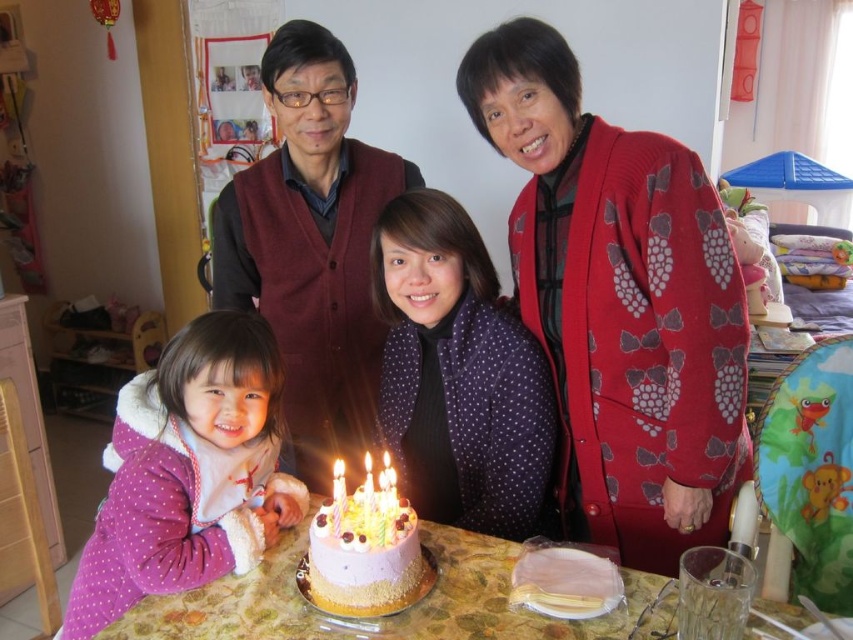
Question: Which is nearer to the marble-patterned table at center?

Choices:
 (A) red knitwear at upper right
 (B) purple dotted sweater at center
 (C) purple fleece jacket at lower left

Answer: (C)

Question: Which object appears farthest from the camera in this image?

Choices:
 (A) marble-patterned table at center
 (B) white frosted cake at center
 (C) purple dotted sweater at center

Answer: (C)

Question: Is red knitwear at upper right further to camera compared to white frosted cake at center?

Choices:
 (A) yes
 (B) no

Answer: (A)

Question: Is red knitwear at upper right smaller than white frosted cake at center?

Choices:
 (A) no
 (B) yes

Answer: (A)

Question: From the image, what is the correct spatial relationship of purple dotted sweater at center in relation to purple fleece jacket at lower left?

Choices:
 (A) left
 (B) right

Answer: (B)

Question: Which object appears closest to the camera in this image?

Choices:
 (A) purple dotted sweater at center
 (B) marble-patterned table at center
 (C) red knitwear at upper right

Answer: (B)